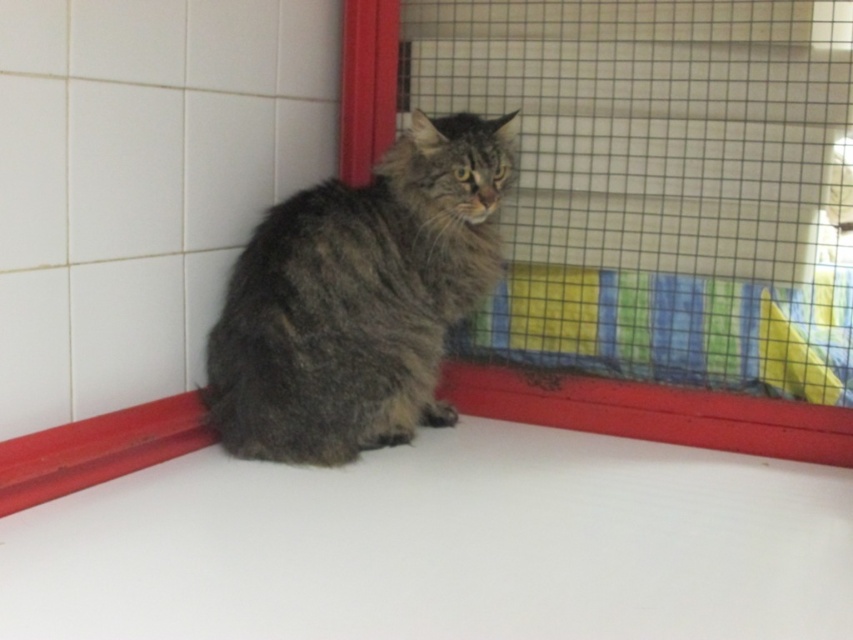
Between gray fluffy cat at center and soft mesh cage at center, which one appears on the left side from the viewer's perspective?

Positioned to the left is gray fluffy cat at center.

The width and height of the screenshot is (853, 640). Describe the element at coordinates (358, 298) in the screenshot. I see `gray fluffy cat at center` at that location.

Between point (293, 355) and point (635, 433), which one is positioned behind?

The point (635, 433) is more distant.

Image resolution: width=853 pixels, height=640 pixels. In order to click on gray fluffy cat at center in this screenshot , I will do `click(358, 298)`.